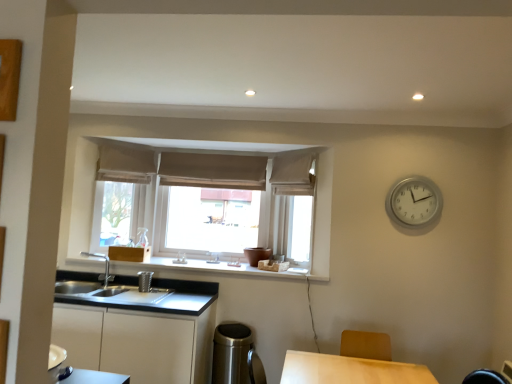
Question: From a real-world perspective, relative to white matte cabinet at lower left, is white fabric curtain at upper center, which appears as the 3th curtain when viewed from the left, vertically above or below?

Choices:
 (A) below
 (B) above

Answer: (B)

Question: Considering the positions of white fabric curtain at upper center, which appears as the 3th curtain when viewed from the left, and white matte cabinet at lower left in the image, is white fabric curtain at upper center, which appears as the 3th curtain when viewed from the left, taller or shorter than white matte cabinet at lower left?

Choices:
 (A) short
 (B) tall

Answer: (A)

Question: Which object is the closest to the brown fabric curtain at center, acting as the second curtain starting from the left?

Choices:
 (A) metallic stainless steel sink at lower left
 (B) white matte window sill at center
 (C) white fabric curtain at upper center, the first curtain viewed from the right
 (D) white matte cabinet at lower left
 (E) silver metallic clock at upper right

Answer: (C)

Question: Based on their relative distances, which object is farther from the silver metallic clock at upper right?

Choices:
 (A) brown fabric curtain at center, marked as the 2th curtain in a right-to-left arrangement
 (B) polished stainless steel trash can at lower center
 (C) metallic stainless steel sink at lower left
 (D) white fabric curtain at upper center, the first curtain viewed from the right
 (E) beige fabric curtain at upper center, the 1th curtain from the left

Answer: (E)